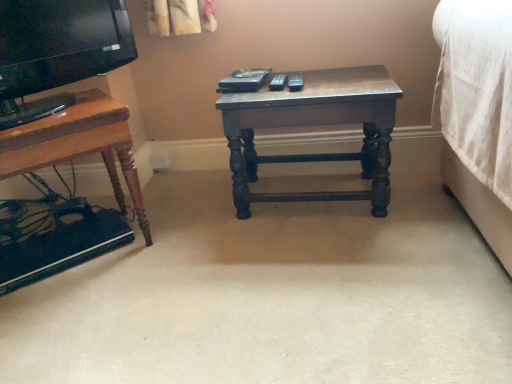
Find the location of a particular element. This screenshot has height=384, width=512. free spot in front of dark wood table at center, marked as the first table in a right-to-left arrangement is located at coordinates (339, 258).